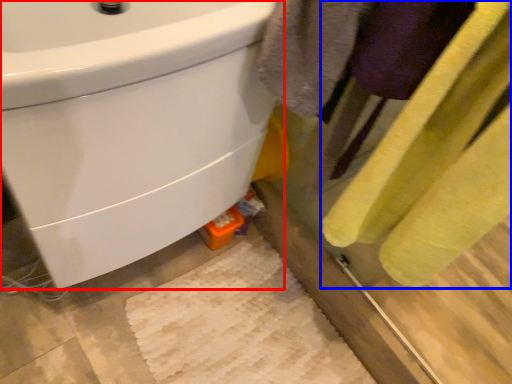
Question: Which point is further to the camera, sink (highlighted by a red box) or bath towel (highlighted by a blue box)?

Choices:
 (A) sink
 (B) bath towel

Answer: (A)